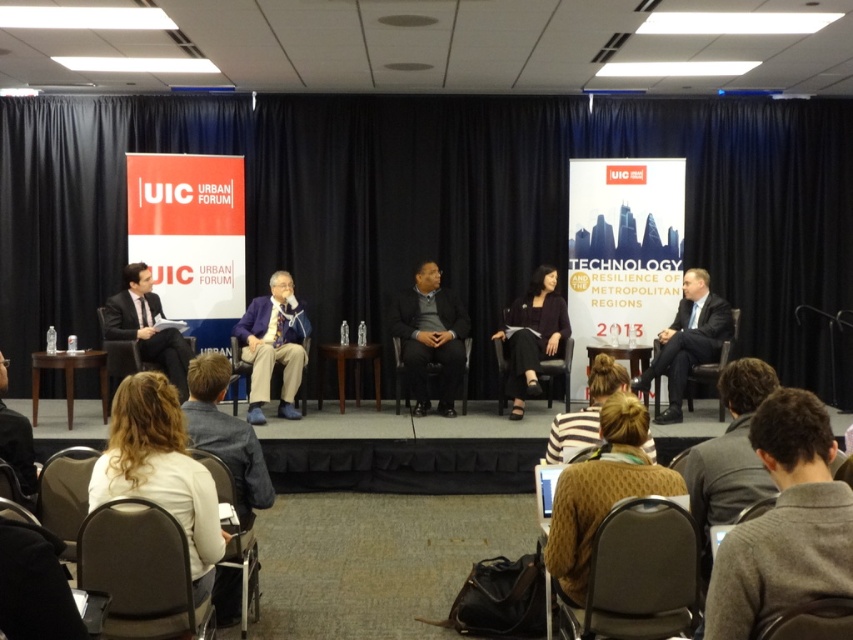
You are standing at the point marked as point (93,570) in the image. If you want to walk straight towards the nearest exit, which direction should you go?

The nearest exit is located to the north of point (93,570).

You are an attendee sitting in the audience and need to ask a question to the panelist sitting in the velvet brown chair at lower right and the black fabric chair at center. Which chair do you need to walk towards to get closer to the front of the stage?

The velvet brown chair at lower right is closer to the viewer than the black fabric chair at center, so you should walk towards the velvet brown chair at lower right to get closer to the front of the stage.